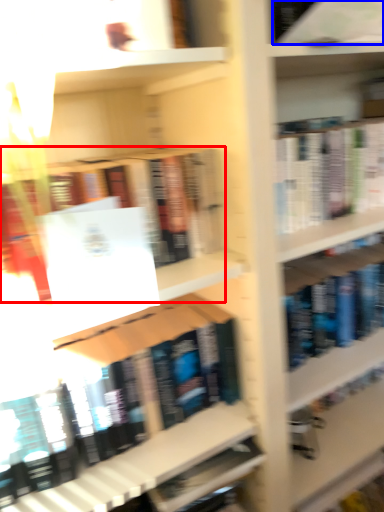
Question: Which point is closer to the camera, book (highlighted by a red box) or book (highlighted by a blue box)?

Choices:
 (A) book
 (B) book

Answer: (A)